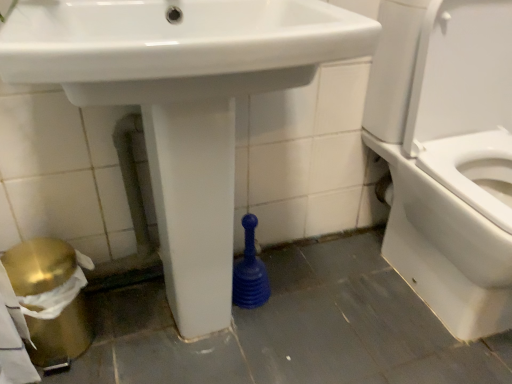
Question: Is white glossy toilet at right situated inside white glossy sink at center or outside?

Choices:
 (A) outside
 (B) inside

Answer: (A)

Question: Is white glossy toilet at right in front of or behind white glossy sink at center in the image?

Choices:
 (A) front
 (B) behind

Answer: (B)

Question: Would you say white glossy toilet at right is to the left or to the right of white glossy sink at center in the picture?

Choices:
 (A) left
 (B) right

Answer: (B)

Question: Is white glossy sink at center in front of or behind white glossy toilet at right in the image?

Choices:
 (A) front
 (B) behind

Answer: (A)

Question: Considering the positions of white glossy sink at center and white glossy toilet at right in the image, is white glossy sink at center wider or thinner than white glossy toilet at right?

Choices:
 (A) wide
 (B) thin

Answer: (B)

Question: From a real-world perspective, is white glossy sink at center physically located above or below white glossy toilet at right?

Choices:
 (A) below
 (B) above

Answer: (B)

Question: Is white glossy sink at center to the left or to the right of white glossy toilet at right in the image?

Choices:
 (A) right
 (B) left

Answer: (B)